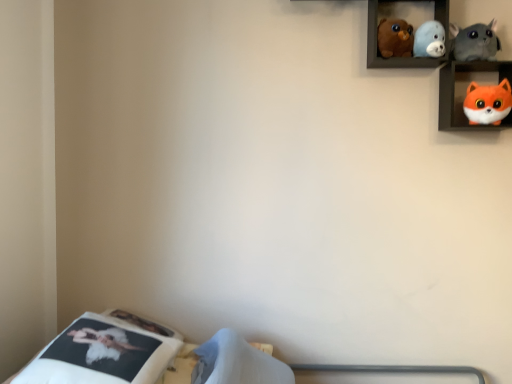
What do you see at coordinates (487, 103) in the screenshot? I see `fluffy orange plush at upper right, which is the 4th toy from left to right` at bounding box center [487, 103].

This screenshot has height=384, width=512. I want to click on orange plush toy at upper right, which is the second shelf from left to right, so click(466, 91).

This screenshot has width=512, height=384. What do you see at coordinates (429, 40) in the screenshot? I see `soft plush seal at upper center, positioned as the third toy in right-to-left order` at bounding box center [429, 40].

Where is `white fabric mattress at lower left`? This screenshot has width=512, height=384. white fabric mattress at lower left is located at coordinates (104, 352).

Identify the location of fluffy orange plush at upper right, which is counted as the first toy, starting from the right. tap(487, 103).

Considering the sizes of objects orange plush toy at upper right, which is the first shelf from bottom to top, and soft plush toys at upper center, the second shelf when ordered from bottom to top, in the image provided, who is taller, orange plush toy at upper right, which is the first shelf from bottom to top, or soft plush toys at upper center, the second shelf when ordered from bottom to top,?

soft plush toys at upper center, the second shelf when ordered from bottom to top, is taller.

Are orange plush toy at upper right, positioned as the 2th shelf in top-to-bottom order, and soft plush toys at upper center, which appears as the first shelf when viewed from the top, beside each other?

There is a gap between orange plush toy at upper right, positioned as the 2th shelf in top-to-bottom order, and soft plush toys at upper center, which appears as the first shelf when viewed from the top.

Considering the sizes of orange plush toy at upper right, the 1th shelf in the right-to-left sequence, and soft plush toys at upper center, the second shelf when ordered from bottom to top, in the image, is orange plush toy at upper right, the 1th shelf in the right-to-left sequence, bigger or smaller than soft plush toys at upper center, the second shelf when ordered from bottom to top,?

In the image, orange plush toy at upper right, the 1th shelf in the right-to-left sequence, appears to be larger than soft plush toys at upper center, the second shelf when ordered from bottom to top.

Is brown plush toy at upper center, which is the 4th toy in right-to-left order, surrounded by orange plush toy at upper right, which is the second shelf from left to right?

No, brown plush toy at upper center, which is the 4th toy in right-to-left order, is not inside orange plush toy at upper right, which is the second shelf from left to right.

From their relative heights in the image, would you say orange plush toy at upper right, the 1th shelf in the right-to-left sequence, is taller or shorter than brown plush toy at upper center, which is counted as the first toy, starting from the left?

In the image, orange plush toy at upper right, the 1th shelf in the right-to-left sequence, appears to be taller than brown plush toy at upper center, which is counted as the first toy, starting from the left.

Is there a large distance between orange plush toy at upper right, which is the second shelf from left to right, and brown plush toy at upper center, which is the 4th toy in right-to-left order?

That's not correct — orange plush toy at upper right, which is the second shelf from left to right, is a little close to brown plush toy at upper center, which is the 4th toy in right-to-left order.

From the picture: Is orange plush toy at upper right, which is the second shelf from left to right, bigger or smaller than brown plush toy at upper center, which is the 4th toy in right-to-left order?

Clearly, orange plush toy at upper right, which is the second shelf from left to right, is larger in size than brown plush toy at upper center, which is the 4th toy in right-to-left order.

From the image's perspective, is fluffy gray cat at upper right, marked as the 3th toy in a left-to-right arrangement, positioned above or below orange plush toy at upper right, positioned as the 2th shelf in top-to-bottom order?

Based on their image positions, fluffy gray cat at upper right, marked as the 3th toy in a left-to-right arrangement, is located above orange plush toy at upper right, positioned as the 2th shelf in top-to-bottom order.

Is the surface of fluffy gray cat at upper right, positioned as the second toy in right-to-left order, in direct contact with orange plush toy at upper right, which is the first shelf from bottom to top?

fluffy gray cat at upper right, positioned as the second toy in right-to-left order, and orange plush toy at upper right, which is the first shelf from bottom to top, are clearly separated.

Is fluffy gray cat at upper right, positioned as the second toy in right-to-left order, closer to the viewer compared to orange plush toy at upper right, which is the second shelf from left to right?

That is False.

There is a orange plush toy at upper right, which is the second shelf from left to right. Identify the location of the 2nd toy above it (from a real-world perspective). The image size is (512, 384). click(x=475, y=42).

How many degrees apart are the facing directions of soft plush toys at upper center, which appears as the first shelf when viewed from the top, and fluffy gray cat at upper right, marked as the 3th toy in a left-to-right arrangement?

The angle between the facing direction of soft plush toys at upper center, which appears as the first shelf when viewed from the top, and the facing direction of fluffy gray cat at upper right, marked as the 3th toy in a left-to-right arrangement, is 2.18 degrees.

In order to click on shelf behind the fluffy gray cat at upper right, positioned as the second toy in right-to-left order in this screenshot , I will do click(391, 57).

Would you say soft plush toys at upper center, which appears as the first shelf when viewed from the top, is inside or outside fluffy gray cat at upper right, positioned as the second toy in right-to-left order?

soft plush toys at upper center, which appears as the first shelf when viewed from the top, lies outside fluffy gray cat at upper right, positioned as the second toy in right-to-left order.

In terms of width, does soft plush toys at upper center, the second shelf when ordered from bottom to top, look wider or thinner when compared to fluffy gray cat at upper right, marked as the 3th toy in a left-to-right arrangement?

Result: soft plush toys at upper center, the second shelf when ordered from bottom to top, is wider than fluffy gray cat at upper right, marked as the 3th toy in a left-to-right arrangement.

What's the angular difference between brown plush toy at upper center, which is counted as the first toy, starting from the left, and orange plush toy at upper right, positioned as the 2th shelf in top-to-bottom order,'s facing directions?

2.18 degrees separate the facing orientations of brown plush toy at upper center, which is counted as the first toy, starting from the left, and orange plush toy at upper right, positioned as the 2th shelf in top-to-bottom order.

Does point (404, 25) lie in front of point (461, 90)?

Yes, point (404, 25) is in front of point (461, 90).

Considering the relative sizes of brown plush toy at upper center, which is counted as the first toy, starting from the left, and orange plush toy at upper right, which is the first shelf from bottom to top, in the image provided, is brown plush toy at upper center, which is counted as the first toy, starting from the left, wider than orange plush toy at upper right, which is the first shelf from bottom to top,?

Incorrect, the width of brown plush toy at upper center, which is counted as the first toy, starting from the left, does not surpass that of orange plush toy at upper right, which is the first shelf from bottom to top.

Is brown plush toy at upper center, which is counted as the first toy, starting from the left, taller or shorter than orange plush toy at upper right, which is the first shelf from bottom to top?

Clearly, brown plush toy at upper center, which is counted as the first toy, starting from the left, is shorter compared to orange plush toy at upper right, which is the first shelf from bottom to top.

Considering the sizes of objects brown plush toy at upper center, which is the 4th toy in right-to-left order, and fluffy gray cat at upper right, marked as the 3th toy in a left-to-right arrangement, in the image provided, who is wider, brown plush toy at upper center, which is the 4th toy in right-to-left order, or fluffy gray cat at upper right, marked as the 3th toy in a left-to-right arrangement,?

With larger width is brown plush toy at upper center, which is the 4th toy in right-to-left order.

Is brown plush toy at upper center, which is counted as the first toy, starting from the left, positioned with its back to fluffy gray cat at upper right, positioned as the second toy in right-to-left order?

That's not correct — brown plush toy at upper center, which is counted as the first toy, starting from the left, is not looking away from fluffy gray cat at upper right, positioned as the second toy in right-to-left order.

Considering the sizes of objects brown plush toy at upper center, which is the 4th toy in right-to-left order, and fluffy gray cat at upper right, positioned as the second toy in right-to-left order, in the image provided, who is taller, brown plush toy at upper center, which is the 4th toy in right-to-left order, or fluffy gray cat at upper right, positioned as the second toy in right-to-left order,?

With more height is fluffy gray cat at upper right, positioned as the second toy in right-to-left order.

Does brown plush toy at upper center, which is the 4th toy in right-to-left order, contain fluffy gray cat at upper right, positioned as the second toy in right-to-left order?

No, brown plush toy at upper center, which is the 4th toy in right-to-left order, does not contain fluffy gray cat at upper right, positioned as the second toy in right-to-left order.

Is soft plush toys at upper center, marked as the first shelf in a left-to-right arrangement, far away from orange plush toy at upper right, the 1th shelf in the right-to-left sequence?

No, soft plush toys at upper center, marked as the first shelf in a left-to-right arrangement, is in close proximity to orange plush toy at upper right, the 1th shelf in the right-to-left sequence.

Considering the relative positions of soft plush toys at upper center, which appears as the first shelf when viewed from the top, and orange plush toy at upper right, which is the second shelf from left to right, in the image provided, is soft plush toys at upper center, which appears as the first shelf when viewed from the top, to the right of orange plush toy at upper right, which is the second shelf from left to right, from the viewer's perspective?

No, soft plush toys at upper center, which appears as the first shelf when viewed from the top, is not to the right of orange plush toy at upper right, which is the second shelf from left to right.

Between soft plush toys at upper center, which appears as the first shelf when viewed from the top, and orange plush toy at upper right, which is the first shelf from bottom to top, which one has smaller size?

soft plush toys at upper center, which appears as the first shelf when viewed from the top.

This screenshot has height=384, width=512. Identify the location of shelf that is on the right side of soft plush toys at upper center, which appears as the first shelf when viewed from the top. (466, 91).

I want to click on shelf located in front of the brown plush toy at upper center, which is counted as the first toy, starting from the left, so click(466, 91).

Estimate the real-world distances between objects in this image. Which object is further from fluffy gray cat at upper right, marked as the 3th toy in a left-to-right arrangement, fluffy orange plush at upper right, which is counted as the first toy, starting from the right, or soft plush seal at upper center, which is the second toy from left to right?

fluffy orange plush at upper right, which is counted as the first toy, starting from the right, is further to fluffy gray cat at upper right, marked as the 3th toy in a left-to-right arrangement.

From the image, which object appears to be nearer to orange plush toy at upper right, positioned as the 2th shelf in top-to-bottom order, soft plush toys at upper center, marked as the first shelf in a left-to-right arrangement, or brown plush toy at upper center, which is counted as the first toy, starting from the left?

soft plush toys at upper center, marked as the first shelf in a left-to-right arrangement, is positioned closer to the anchor orange plush toy at upper right, positioned as the 2th shelf in top-to-bottom order.

Considering their positions, is fluffy gray cat at upper right, marked as the 3th toy in a left-to-right arrangement, positioned further to white fabric mattress at lower left than fluffy orange plush at upper right, which is the 4th toy from left to right?

Among the two, fluffy gray cat at upper right, marked as the 3th toy in a left-to-right arrangement, is located further to white fabric mattress at lower left.

Considering their positions, is soft plush seal at upper center, positioned as the third toy in right-to-left order, positioned further to soft plush toys at upper center, which appears as the first shelf when viewed from the top, than white fabric mattress at lower left?

Among the two, white fabric mattress at lower left is located further to soft plush toys at upper center, which appears as the first shelf when viewed from the top.

Which object lies further to the anchor point orange plush toy at upper right, which is the second shelf from left to right, fluffy orange plush at upper right, which is counted as the first toy, starting from the right, or soft plush seal at upper center, which is the second toy from left to right?

soft plush seal at upper center, which is the second toy from left to right, lies further to orange plush toy at upper right, which is the second shelf from left to right, than the other object.

Which object lies further to the anchor point soft plush toys at upper center, marked as the first shelf in a left-to-right arrangement, brown plush toy at upper center, which is counted as the first toy, starting from the left, or fluffy orange plush at upper right, which is counted as the first toy, starting from the right?

fluffy orange plush at upper right, which is counted as the first toy, starting from the right, is further to soft plush toys at upper center, marked as the first shelf in a left-to-right arrangement.

Based on their spatial positions, is white fabric mattress at lower left or soft plush toys at upper center, marked as the first shelf in a left-to-right arrangement, further from fluffy gray cat at upper right, positioned as the second toy in right-to-left order?

white fabric mattress at lower left is further to fluffy gray cat at upper right, positioned as the second toy in right-to-left order.

From the image, which object appears to be farther from soft plush toys at upper center, the second shelf when ordered from bottom to top, soft plush seal at upper center, positioned as the third toy in right-to-left order, or fluffy gray cat at upper right, marked as the 3th toy in a left-to-right arrangement?

fluffy gray cat at upper right, marked as the 3th toy in a left-to-right arrangement.

Find the location of a particular element. The height and width of the screenshot is (384, 512). shelf between brown plush toy at upper center, which is counted as the first toy, starting from the left, and soft plush seal at upper center, positioned as the third toy in right-to-left order, in the horizontal direction is located at coordinates (391, 57).

At what (x,y) coordinates should I click in order to perform the action: click on toy between fluffy gray cat at upper right, marked as the 3th toy in a left-to-right arrangement, and orange plush toy at upper right, which is the first shelf from bottom to top, in the up-down direction. Please return your answer as a coordinate pair (x, y). Image resolution: width=512 pixels, height=384 pixels. Looking at the image, I should click on (429, 40).

This screenshot has height=384, width=512. In order to click on shelf between soft plush toys at upper center, the second shelf when ordered from bottom to top, and fluffy orange plush at upper right, which is counted as the first toy, starting from the right, from top to bottom in this screenshot , I will do `click(466, 91)`.

Find the location of a particular element. shelf between soft plush seal at upper center, positioned as the third toy in right-to-left order, and fluffy orange plush at upper right, which is counted as the first toy, starting from the right, vertically is located at coordinates [x=466, y=91].